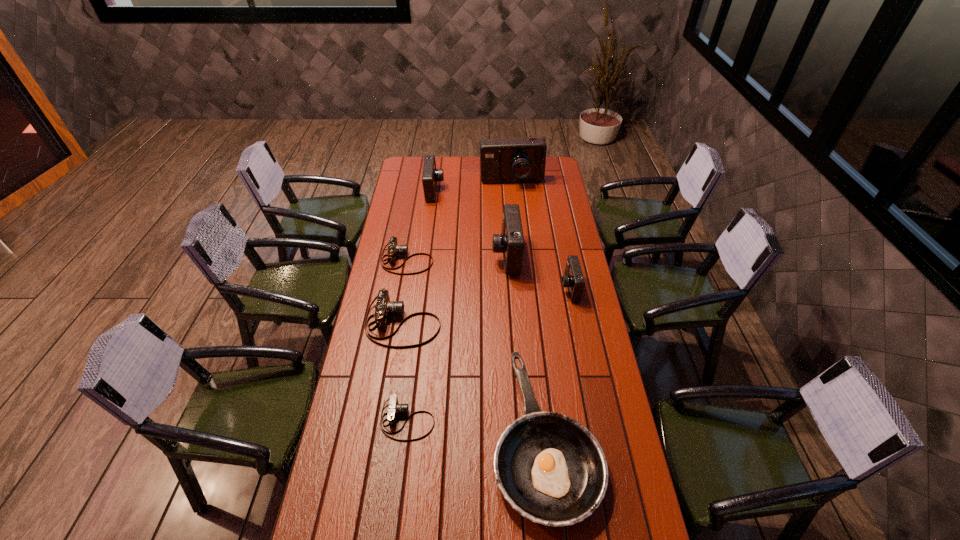
The height and width of the screenshot is (540, 960). I want to click on free location that satisfies the following two spatial constraints: 1. on the back side of the red frying pan; 2. on the front-facing side of the nearest brown camera, so click(542, 420).